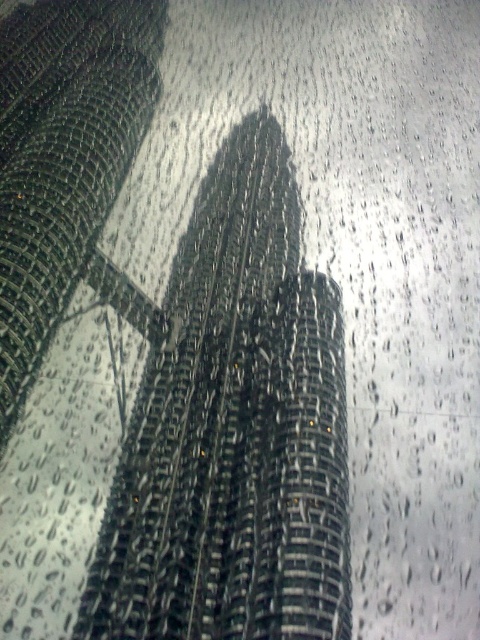
Based on the photo, you are standing in front of a wet window with water droplets. You notice two towers reflected in the window. One is a reflective glass tower at center and the other is a metallic grid tower at center. Which tower do you see first when looking through the window?

The reflective glass tower at center is closer to the viewer than the metallic grid tower at center, so you see the reflective glass tower at center first.

What are the coordinates of the reflective glass tower at center?

The coordinates of the reflective glass tower at center are (233,432).